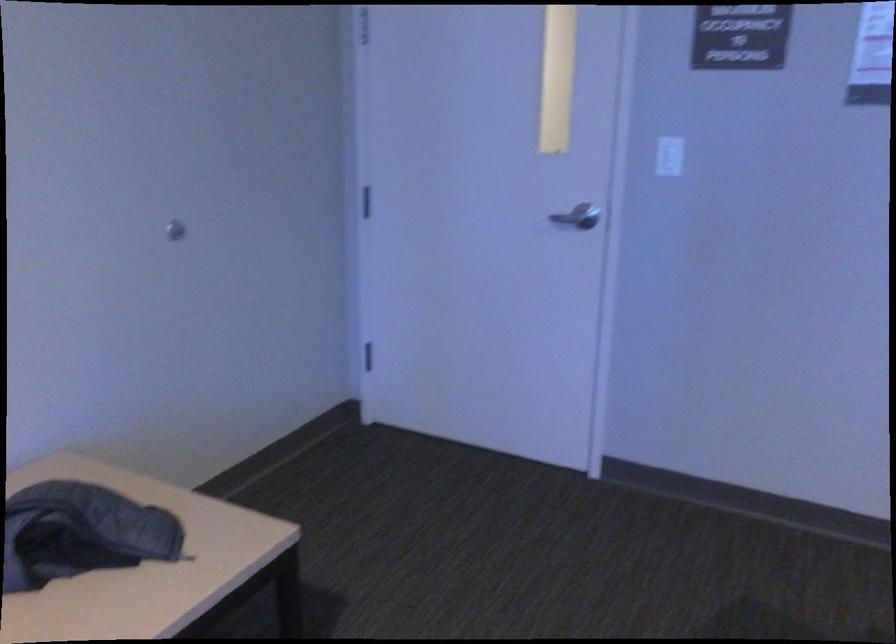
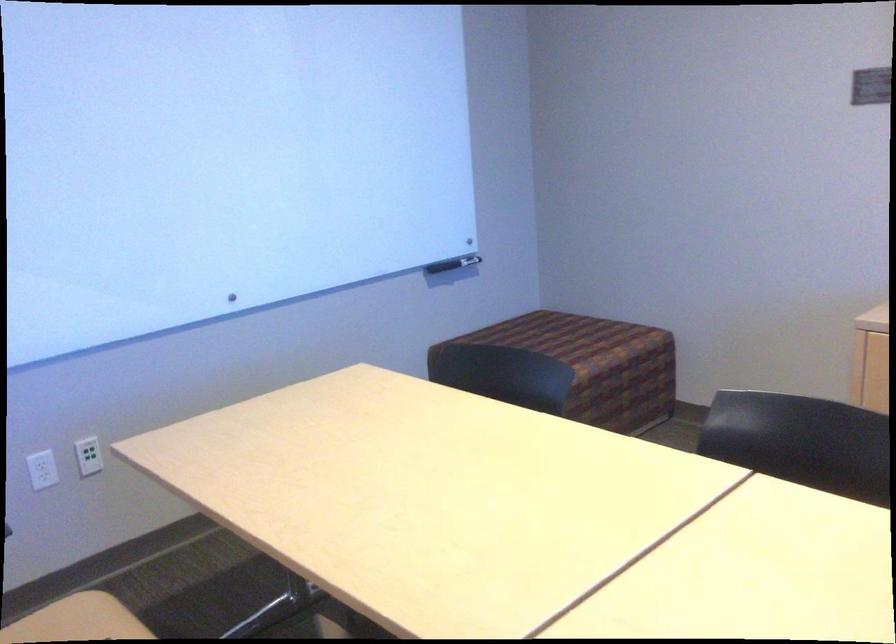
Question: The camera is either moving clockwise (left) or counter-clockwise (right) around the object. The first image is from the beginning of the video and the second image is from the end. Is the camera moving left or right when shooting the video?

Choices:
 (A) Left
 (B) Right

Answer: (A)